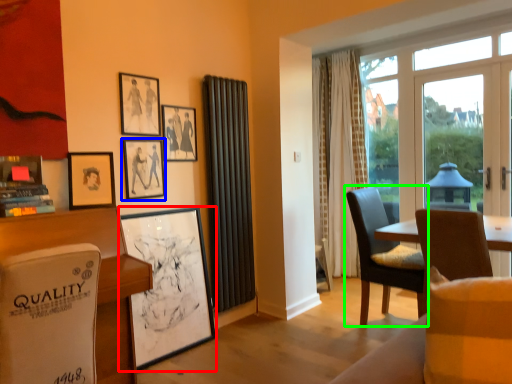
Question: Estimate the real-world distances between objects in this image. Which object is farther from picture frame (highlighted by a red box), picture frame (highlighted by a blue box) or chair (highlighted by a green box)?

Choices:
 (A) picture frame
 (B) chair

Answer: (B)